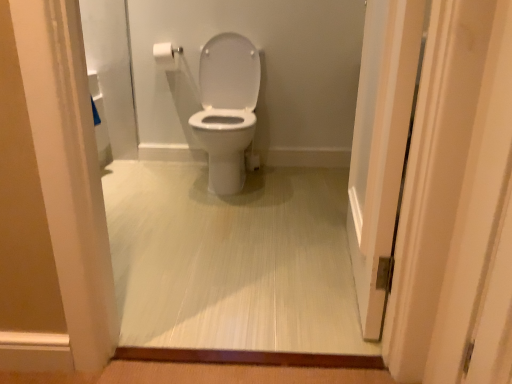
Find the location of `vacant space situated above white glossy toilet at center (from a real-world perspective)`. vacant space situated above white glossy toilet at center (from a real-world perspective) is located at coordinates (223, 250).